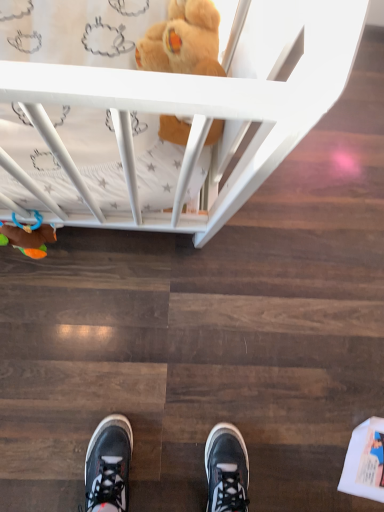
Question: Visually, is soft plush toy at lower left, placed as the first toy when sorted from bottom to top, positioned to the left or to the right of soft plush bear at upper center, the second toy viewed from the left?

Choices:
 (A) right
 (B) left

Answer: (B)

Question: Is soft plush toy at lower left, marked as the 2th toy in a top-to-bottom arrangement, inside the boundaries of soft plush bear at upper center, the second toy when ordered from bottom to top, or outside?

Choices:
 (A) outside
 (B) inside

Answer: (A)

Question: Considering the positions of soft plush toy at lower left, placed as the first toy when sorted from bottom to top, and soft plush bear at upper center, which is the first toy from right to left, in the image, is soft plush toy at lower left, placed as the first toy when sorted from bottom to top, wider or thinner than soft plush bear at upper center, which is the first toy from right to left,?

Choices:
 (A) thin
 (B) wide

Answer: (A)

Question: From a real-world perspective, is soft plush bear at upper center, which is the first toy from top to bottom, physically located above or below soft plush toy at lower left, placed as the first toy when sorted from bottom to top?

Choices:
 (A) below
 (B) above

Answer: (B)

Question: From the image's perspective, is soft plush bear at upper center, the second toy viewed from the left, located above or below soft plush toy at lower left, marked as the 2th toy in a top-to-bottom arrangement?

Choices:
 (A) above
 (B) below

Answer: (A)

Question: Considering the positions of soft plush bear at upper center, which is the first toy from top to bottom, and soft plush toy at lower left, marked as the 2th toy in a top-to-bottom arrangement, in the image, is soft plush bear at upper center, which is the first toy from top to bottom, bigger or smaller than soft plush toy at lower left, marked as the 2th toy in a top-to-bottom arrangement,?

Choices:
 (A) big
 (B) small

Answer: (A)

Question: Considering the positions of point (195, 38) and point (51, 237), is point (195, 38) closer or farther from the camera than point (51, 237)?

Choices:
 (A) farther
 (B) closer

Answer: (B)